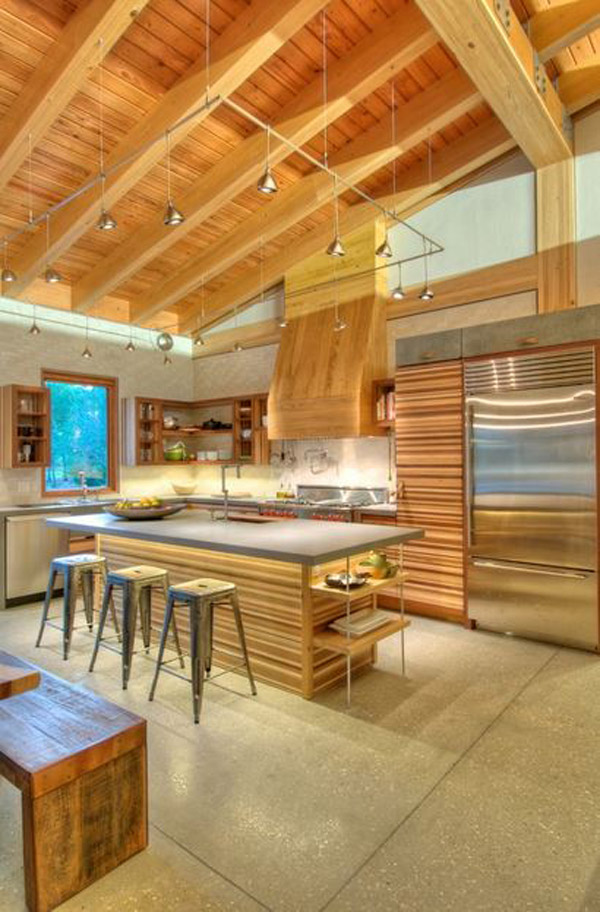
At what (x,y) coordinates should I click in order to perform the action: click on cupboard. Please return your answer as a coordinate pair (x, y). Looking at the image, I should click on (151, 430).